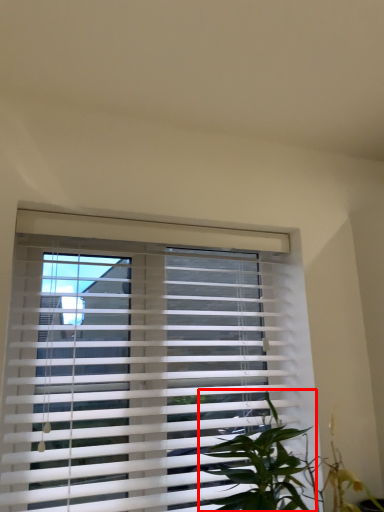
Question: From the image's perspective, considering the relative positions of vegetation (annotated by the red box) and window blind in the image provided, where is vegetation (annotated by the red box) located with respect to the staircase?

Choices:
 (A) above
 (B) below

Answer: (B)